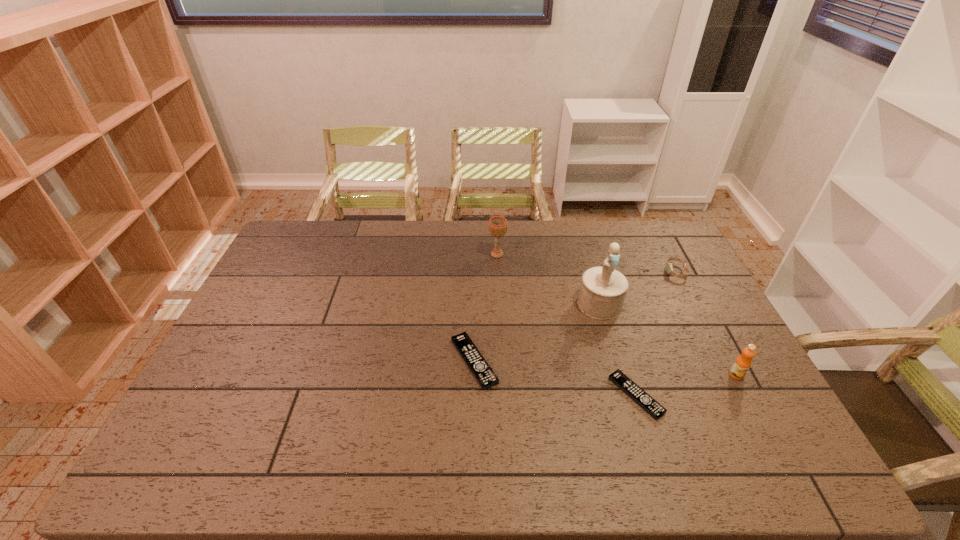
Observe the arrangement of all remote controls in the image. To keep them evenly spaced, where would you place another remote control on the left? Please locate a free space. Please provide its 2D coordinates. Your answer should be formatted as a tuple, i.e. [(x, y)], where the tuple contains the x and y coordinates of a point satisfying the conditions above.

[(333, 332)]